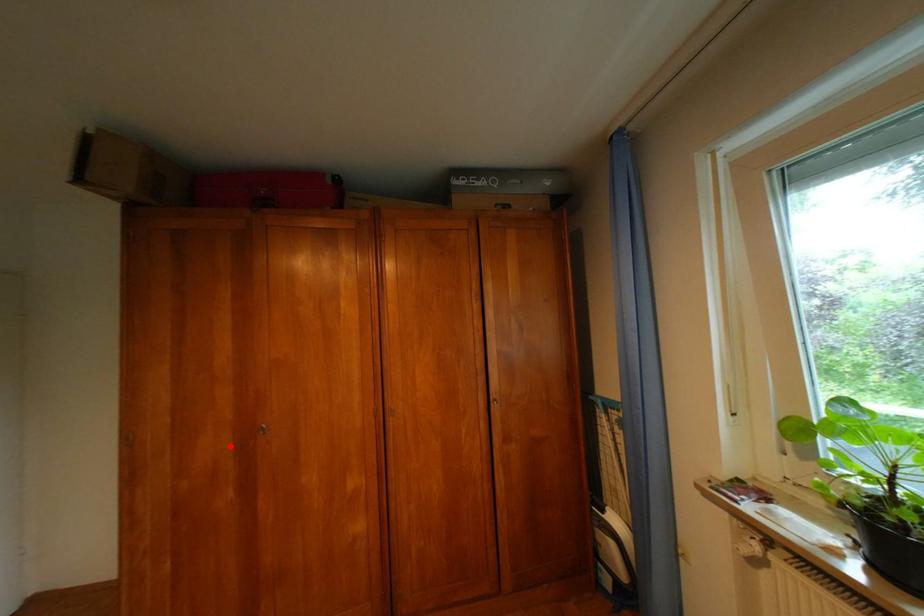
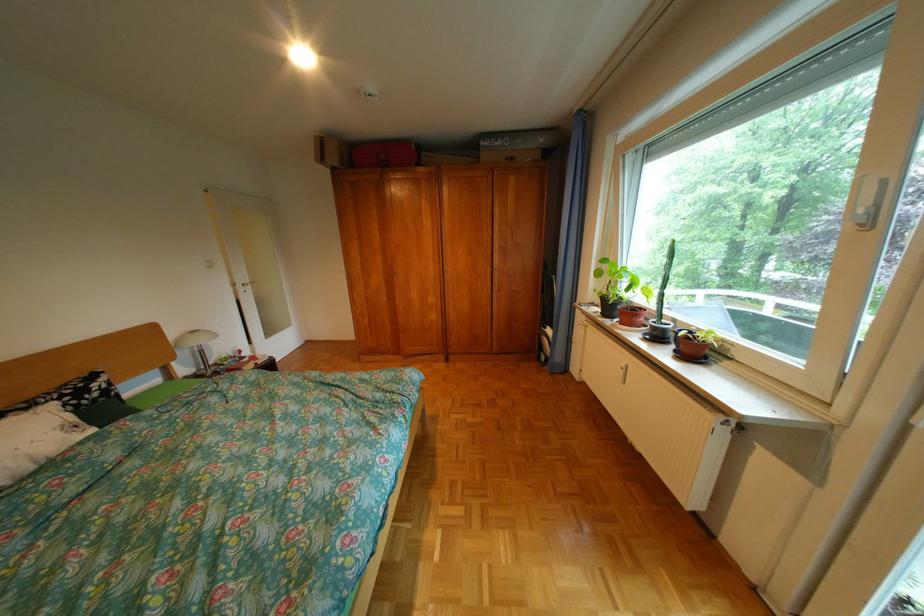
Question: I am providing you with two images of the same scene from different viewpoints. In image1, a red point is highlighted. Considering the same 3D point in image2, which of the following is correct?

Choices:
 (A) It is closer
 (B) It is farther

Answer: (A)